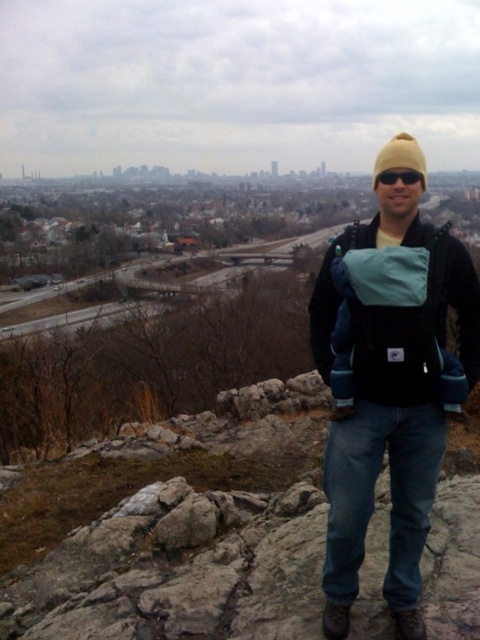
How distant is black fleece jacket at center from beige knit beanie at upper center?

A distance of 6.31 feet exists between black fleece jacket at center and beige knit beanie at upper center.

Does black fleece jacket at center have a greater width compared to beige knit beanie at upper center?

In fact, black fleece jacket at center might be narrower than beige knit beanie at upper center.

Who is more forward, (x=370, y=483) or (x=405, y=163)?

Point (x=405, y=163) is in front.

The height and width of the screenshot is (640, 480). Identify the location of black fleece jacket at center. (388, 388).

Does black fleece jacket at center appear under black plastic sunglasses at center?

Indeed, black fleece jacket at center is positioned under black plastic sunglasses at center.

Does black fleece jacket at center have a smaller size compared to black plastic sunglasses at center?

No.

This screenshot has width=480, height=640. Describe the element at coordinates (388, 388) in the screenshot. I see `black fleece jacket at center` at that location.

At what (x,y) coordinates should I click in order to perform the action: click on black fleece jacket at center. Please return your answer as a coordinate pair (x, y). The height and width of the screenshot is (640, 480). Looking at the image, I should click on (388, 388).

Between beige knit beanie at upper center and black plastic sunglasses at center, which one has less height?

Standing shorter between the two is black plastic sunglasses at center.

Who is more forward, (x=423, y=161) or (x=394, y=172)?

Point (x=423, y=161) is in front.

Locate an element on the screen. beige knit beanie at upper center is located at coordinates (399, 157).